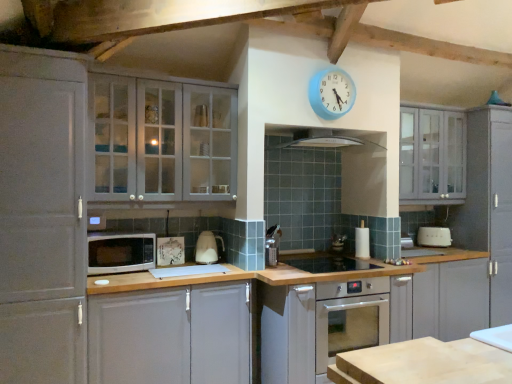
Locate an element on the screen. Image resolution: width=512 pixels, height=384 pixels. vacant space to the left of metallic silver toaster at center, the 2th appliance viewed from the back is located at coordinates (317, 255).